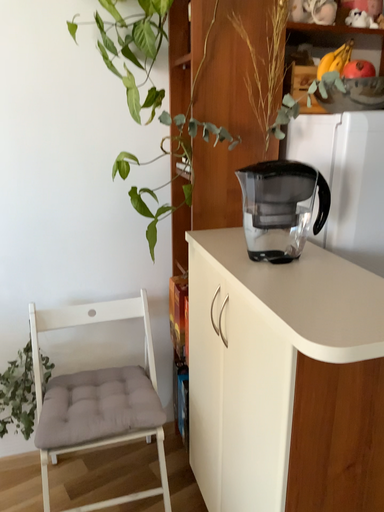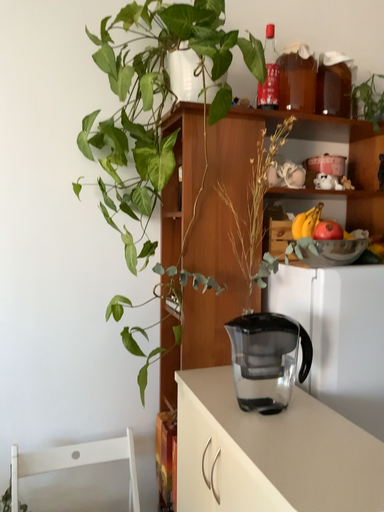
Question: How did the camera likely rotate when shooting the video?

Choices:
 (A) rotated downward
 (B) rotated upward

Answer: (B)